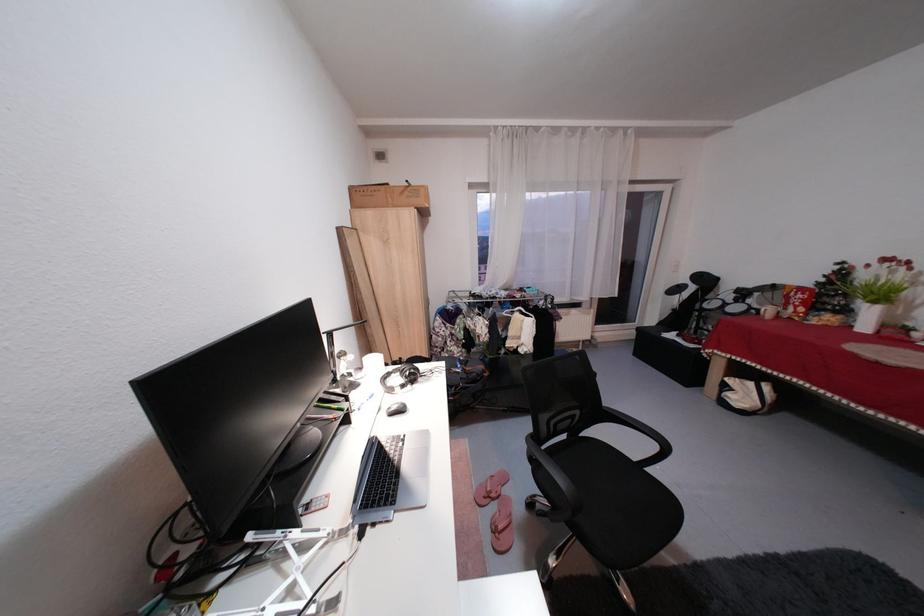
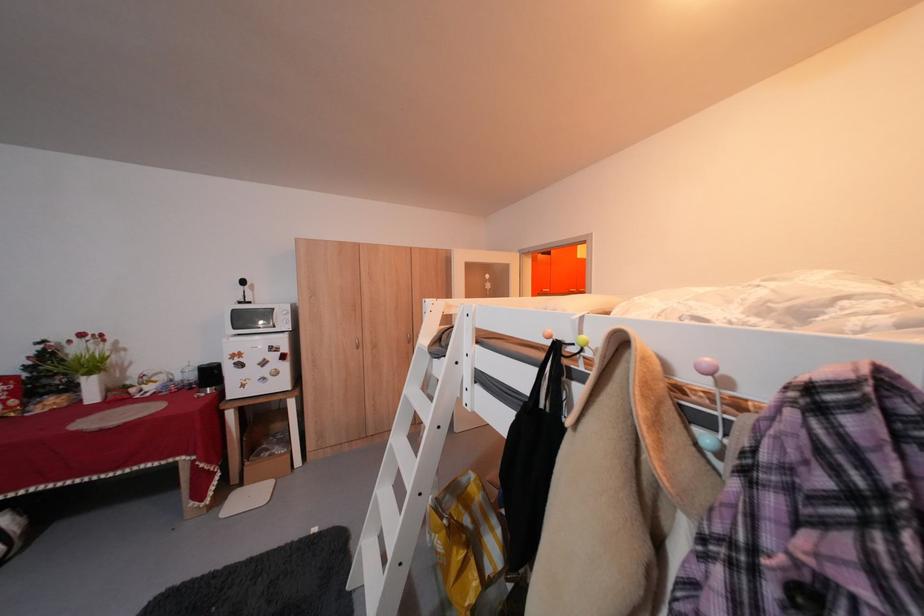
Question: The camera is either moving clockwise (left) or counter-clockwise (right) around the object. The first image is from the beginning of the video and the second image is from the end. Is the camera moving left or right when shooting the video?

Choices:
 (A) Left
 (B) Right

Answer: (A)